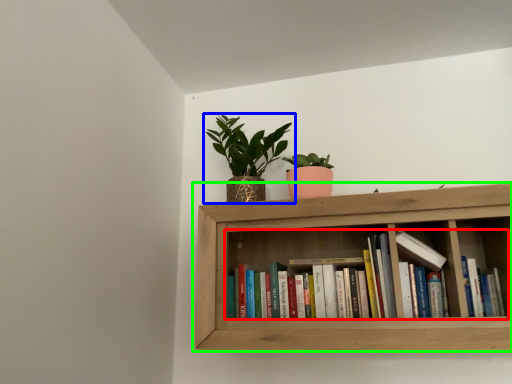
Question: Based on their relative distances, which object is farther from book (highlighted by a red box)? Choose from houseplant (highlighted by a blue box) and shelf (highlighted by a green box).

Choices:
 (A) houseplant
 (B) shelf

Answer: (A)